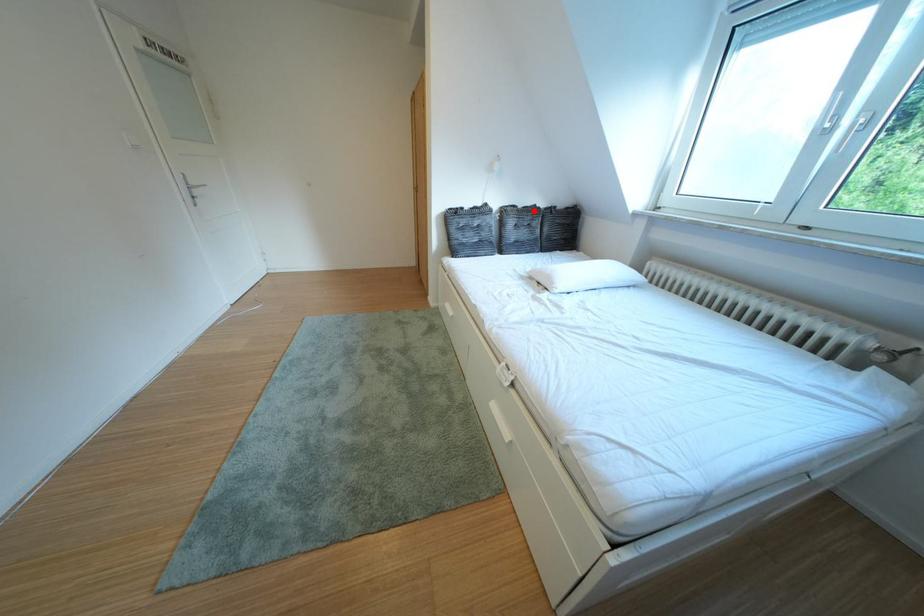
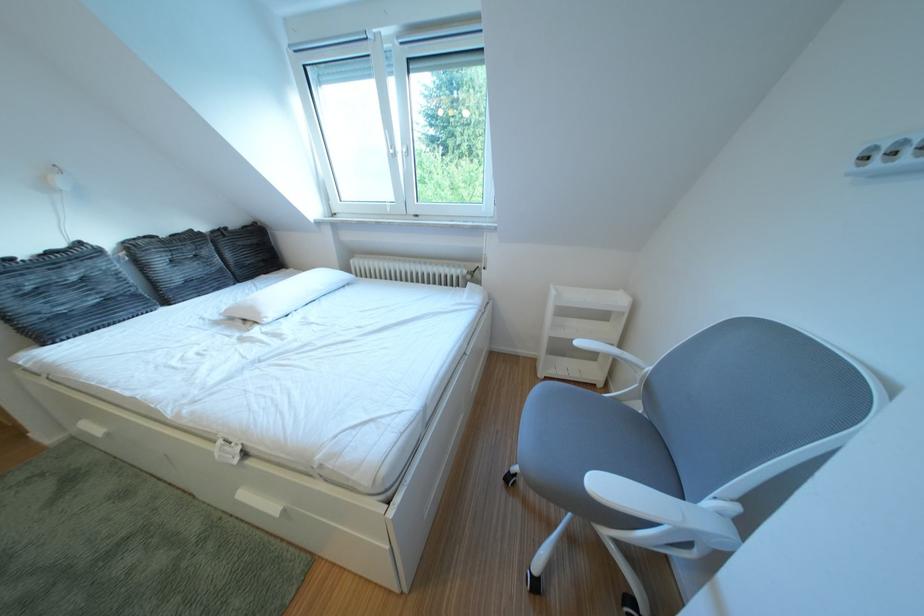
Locate, in the second image, the point that corresponds to the highlighted location in the first image.

(176, 240)